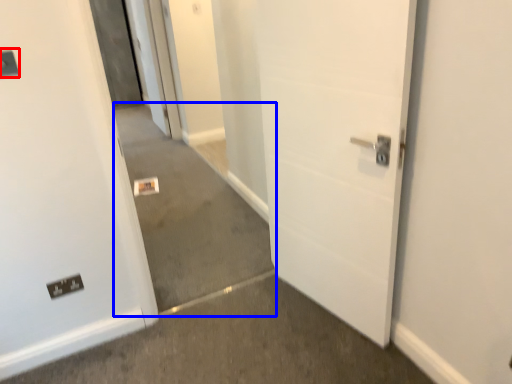
Question: Which point is closer to the camera, light switch (highlighted by a red box) or concrete (highlighted by a blue box)?

Choices:
 (A) light switch
 (B) concrete

Answer: (A)